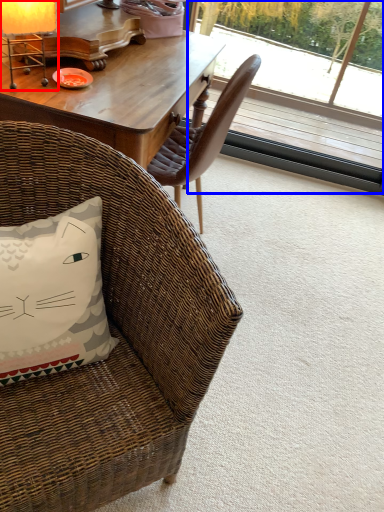
Question: Which of the following is the farthest to the observer, table lamp (highlighted by a red box) or window screen (highlighted by a blue box)?

Choices:
 (A) table lamp
 (B) window screen

Answer: (B)